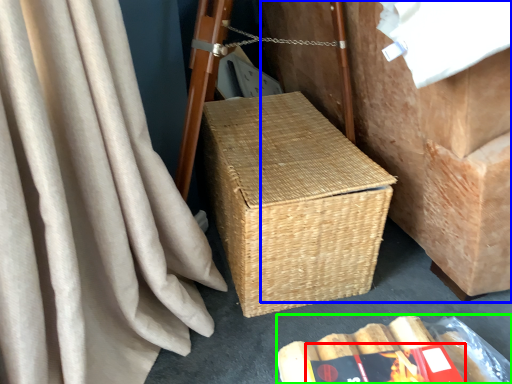
Question: Which object is the farthest from paperback book (highlighted by a red box)? Choose among these: furniture (highlighted by a blue box) or storage box (highlighted by a green box).

Choices:
 (A) furniture
 (B) storage box

Answer: (A)